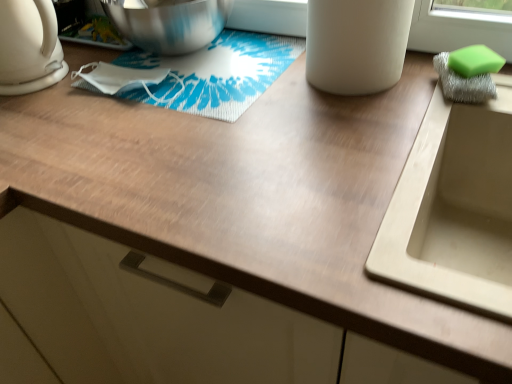
In order to click on green sponge at right in this screenshot , I will do `click(475, 61)`.

In order to click on white glossy kettle at left in this screenshot , I will do `click(29, 47)`.

At what (x,y) coordinates should I click in order to perform the action: click on beige matte sink at right. Please return your answer as a coordinate pair (x, y). The height and width of the screenshot is (384, 512). Looking at the image, I should click on (454, 206).

What's the angular difference between shiny metallic mixing bowl at upper left and white matte cup at upper center's facing directions?

They differ by 0.000378 degrees in their facing directions.

Which of these two, shiny metallic mixing bowl at upper left or white matte cup at upper center, is smaller?

With smaller size is white matte cup at upper center.

Relative to white matte cup at upper center, is shiny metallic mixing bowl at upper left in front or behind?

Clearly, shiny metallic mixing bowl at upper left is behind white matte cup at upper center.

Which is behind, point (140, 3) or point (349, 10)?

The point (140, 3) is more distant.

From the image's perspective, is white matte cup at upper center located beneath white glossy kettle at left?

Correct, white matte cup at upper center appears lower than white glossy kettle at left in the image.

From a real-world perspective, between white matte cup at upper center and white glossy kettle at left, who is vertically higher?

From a 3D spatial view, white glossy kettle at left is above.

Which of these two, white matte cup at upper center or white glossy kettle at left, is wider?

Wider between the two is white matte cup at upper center.

Is white matte cup at upper center further to the viewer compared to white glossy kettle at left?

No, it is in front of white glossy kettle at left.

Is beige matte sink at right touching green sponge at right?

No, beige matte sink at right is not touching green sponge at right.

How different are the orientations of beige matte sink at right and green sponge at right in degrees?

beige matte sink at right and green sponge at right are facing 40.6 degrees away from each other.

Considering the sizes of objects beige matte sink at right and green sponge at right in the image provided, who is smaller, beige matte sink at right or green sponge at right?

Smaller between the two is green sponge at right.

Looking at this image, from a real-world perspective, between white glossy kettle at left and white matte cup at upper center, who is vertically lower?

From a 3D spatial view, white matte cup at upper center is below.

Is white glossy kettle at left in front of or behind white matte cup at upper center in the image?

white glossy kettle at left is behind white matte cup at upper center.

Would you say white glossy kettle at left contains white matte cup at upper center?

No, white glossy kettle at left does not contain white matte cup at upper center.

Considering their positions, is green sponge at right located in front of or behind shiny metallic mixing bowl at upper left?

green sponge at right is in front of shiny metallic mixing bowl at upper left.

Would you say green sponge at right is outside shiny metallic mixing bowl at upper left?

Yes, green sponge at right is outside of shiny metallic mixing bowl at upper left.

Is green sponge at right oriented away from shiny metallic mixing bowl at upper left?

That's not correct — green sponge at right is not looking away from shiny metallic mixing bowl at upper left.

Is green sponge at right taller than shiny metallic mixing bowl at upper left?

In fact, green sponge at right may be shorter than shiny metallic mixing bowl at upper left.

Is beige matte sink at right in contact with white matte cup at upper center?

No, beige matte sink at right is not with white matte cup at upper center.

I want to click on sink below the white matte cup at upper center (from the image's perspective), so click(x=454, y=206).

From the image's perspective, would you say beige matte sink at right is positioned over white matte cup at upper center?

Incorrect, from the image's perspective, beige matte sink at right is lower than white matte cup at upper center.

In the scene shown: Which object is thinner, beige matte sink at right or white matte cup at upper center?

white matte cup at upper center is thinner.

Which object is thinner, white glossy kettle at left or shiny metallic mixing bowl at upper left?

Thinner between the two is white glossy kettle at left.

From the image's perspective, which one is positioned higher, white glossy kettle at left or shiny metallic mixing bowl at upper left?

shiny metallic mixing bowl at upper left appears higher in the image.

From a real-world perspective, is white glossy kettle at left positioned above or below shiny metallic mixing bowl at upper left?

Clearly, from a real-world perspective, white glossy kettle at left is above shiny metallic mixing bowl at upper left.

In the scene shown: Considering the sizes of white glossy kettle at left and shiny metallic mixing bowl at upper left in the image, is white glossy kettle at left taller or shorter than shiny metallic mixing bowl at upper left?

Considering their sizes, white glossy kettle at left has more height than shiny metallic mixing bowl at upper left.

At what (x,y) coordinates should I click in order to perform the action: click on appliance that is below the shiny metallic mixing bowl at upper left (from the image's perspective). Please return your answer as a coordinate pair (x, y). Looking at the image, I should click on (356, 44).

This screenshot has width=512, height=384. Identify the location of kitchen appliance located behind the white matte cup at upper center. (29, 47).

Looking at the image, which one is located closer to green sponge at right, white matte cup at upper center or beige matte sink at right?

Based on the image, white matte cup at upper center appears to be nearer to green sponge at right.

Considering their positions, is shiny metallic mixing bowl at upper left positioned closer to white glossy kettle at left than white matte cup at upper center?

shiny metallic mixing bowl at upper left is positioned closer to the anchor white glossy kettle at left.

Consider the image. Which object lies nearer to the anchor point green sponge at right, beige matte sink at right or white matte cup at upper center?

white matte cup at upper center lies closer to green sponge at right than the other object.

Based on their spatial positions, is white glossy kettle at left or green sponge at right closer to beige matte sink at right?

Based on the image, green sponge at right appears to be nearer to beige matte sink at right.

Which object lies nearer to the anchor point white matte cup at upper center, beige matte sink at right or green sponge at right?

green sponge at right lies closer to white matte cup at upper center than the other object.

From the image, which object appears to be farther from green sponge at right, beige matte sink at right or white glossy kettle at left?

white glossy kettle at left.

From the image, which object appears to be nearer to green sponge at right, white glossy kettle at left or beige matte sink at right?

beige matte sink at right lies closer to green sponge at right than the other object.

Based on their spatial positions, is white glossy kettle at left or shiny metallic mixing bowl at upper left closer to green sponge at right?

The object closer to green sponge at right is shiny metallic mixing bowl at upper left.

You are a GUI agent. You are given a task and a screenshot of the screen. Output one action in this format:
    pyautogui.click(x=<x>, y=<y>)
    Task: Click on the mixing bowl between white glossy kettle at left and green sponge at right
    
    Given the screenshot: What is the action you would take?
    pyautogui.click(x=168, y=23)

I want to click on mixing bowl between white glossy kettle at left and white matte cup at upper center, so click(168, 23).

Where is `soap between white matte cup at upper center and beige matte sink at right vertically`? soap between white matte cup at upper center and beige matte sink at right vertically is located at coordinates (475, 61).

The image size is (512, 384). What are the coordinates of `appliance between shiny metallic mixing bowl at upper left and beige matte sink at right in the horizontal direction` in the screenshot? It's located at (356, 44).